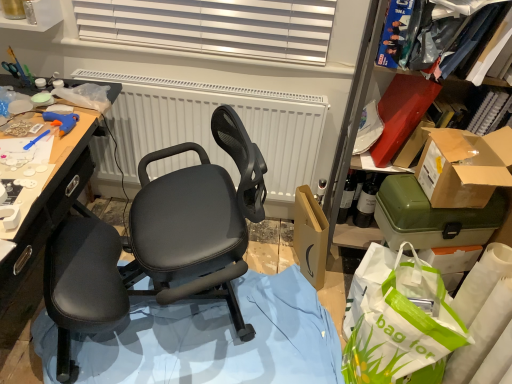
Locate an element on the screen. The image size is (512, 384). brown cardboard box at right, which appears as the first box when viewed from the top is located at coordinates point(460,170).

What do you see at coordinates (162, 240) in the screenshot? This screenshot has height=384, width=512. I see `matte black office chair at center` at bounding box center [162, 240].

Where is `white textured radiator at center`? white textured radiator at center is located at coordinates (210, 127).

Considering the positions of objects green plastic container at right, which ranks as the 2th box in top-to-bottom order, and matte black office chair at center in the image provided, who is more to the right, green plastic container at right, which ranks as the 2th box in top-to-bottom order, or matte black office chair at center?

green plastic container at right, which ranks as the 2th box in top-to-bottom order, is more to the right.

Which object is closer to the camera taking this photo, green plastic container at right, which ranks as the 2th box in top-to-bottom order, or matte black office chair at center?

matte black office chair at center is closer to the camera.

In the scene shown: Is green plastic container at right, which ranks as the 2th box in top-to-bottom order, with matte black office chair at center?

No.

From a real-world perspective, which object rests below the other?

matte black office chair at center.

Is matte black office chair at center further to the viewer compared to green plastic container at right, which ranks as the 2th box in top-to-bottom order?

No.

Starting from the matte black office chair at center, which box is the 1st one to the right? Please provide its 2D coordinates.

[(433, 217)]

Is matte black office chair at center positioned beyond the bounds of green plastic container at right, marked as the first box in a bottom-to-top arrangement?

That's correct, matte black office chair at center is outside of green plastic container at right, marked as the first box in a bottom-to-top arrangement.

Which of these two, matte black office chair at center or white textured radiator at center, is bigger?

With larger size is matte black office chair at center.

Locate an element on the screen. The width and height of the screenshot is (512, 384). radiator behind the matte black office chair at center is located at coordinates (210, 127).

Looking at this image, would you say matte black office chair at center is a long distance from white textured radiator at center?

They are positioned close to each other.

Looking at this image, from a real-world perspective, does brown cardboard box at right, which appears as the first box when viewed from the top, stand above matte black office chair at center?

Yes, from a real-world perspective, brown cardboard box at right, which appears as the first box when viewed from the top, is on top of matte black office chair at center.

What's the angular difference between brown cardboard box at right, which is the 2th box from bottom to top, and matte black office chair at center's facing directions?

brown cardboard box at right, which is the 2th box from bottom to top, and matte black office chair at center are facing 165 degrees away from each other.

This screenshot has height=384, width=512. Find the location of `box that is the 2nd one when counting upward from the matte black office chair at center (from the image's perspective)`. box that is the 2nd one when counting upward from the matte black office chair at center (from the image's perspective) is located at coordinates (460, 170).

Relative to matte black office chair at center, is brown cardboard box at right, which is the 2th box from bottom to top, in front or behind?

Visually, brown cardboard box at right, which is the 2th box from bottom to top, is located behind matte black office chair at center.

Can we say white textured radiator at center lies outside brown cardboard box at right, which is the 2th box from bottom to top?

Absolutely, white textured radiator at center is external to brown cardboard box at right, which is the 2th box from bottom to top.

Can you tell me how much white textured radiator at center and brown cardboard box at right, which is the 2th box from bottom to top, differ in facing direction?

171 degrees separate the facing orientations of white textured radiator at center and brown cardboard box at right, which is the 2th box from bottom to top.

In the image, is white textured radiator at center on the left side or the right side of brown cardboard box at right, which is the 2th box from bottom to top?

white textured radiator at center is positioned on brown cardboard box at right, which is the 2th box from bottom to top,'s left side.

Which object is further away from the camera, white textured radiator at center or brown cardboard box at right, which is the 2th box from bottom to top?

Positioned behind is white textured radiator at center.

Is brown cardboard box at right, which appears as the first box when viewed from the top, looking in the opposite direction of white textured radiator at center?

No, brown cardboard box at right, which appears as the first box when viewed from the top,'s orientation is not away from white textured radiator at center.

From the image's perspective, count 1st boxs downward from the white textured radiator at center and point to it. Please provide its 2D coordinates.

[(460, 170)]

How much distance is there between brown cardboard box at right, which is the 2th box from bottom to top, and white textured radiator at center?

brown cardboard box at right, which is the 2th box from bottom to top, is 29.25 inches away from white textured radiator at center.

Is green plastic container at right, marked as the first box in a bottom-to-top arrangement, far from brown cardboard box at right, which is the 2th box from bottom to top?

That's not correct — green plastic container at right, marked as the first box in a bottom-to-top arrangement, is a little close to brown cardboard box at right, which is the 2th box from bottom to top.

From a real-world perspective, is green plastic container at right, marked as the first box in a bottom-to-top arrangement, on top of brown cardboard box at right, which appears as the first box when viewed from the top?

No, from a real-world perspective, green plastic container at right, marked as the first box in a bottom-to-top arrangement, is not on top of brown cardboard box at right, which appears as the first box when viewed from the top.

Based on the photo, relative to brown cardboard box at right, which appears as the first box when viewed from the top, is green plastic container at right, which ranks as the 2th box in top-to-bottom order, in front or behind?

green plastic container at right, which ranks as the 2th box in top-to-bottom order, is positioned farther from the viewer than brown cardboard box at right, which appears as the first box when viewed from the top.

Looking at their sizes, would you say green plastic container at right, which ranks as the 2th box in top-to-bottom order, is wider or thinner than brown cardboard box at right, which is the 2th box from bottom to top?

Clearly, green plastic container at right, which ranks as the 2th box in top-to-bottom order, has more width compared to brown cardboard box at right, which is the 2th box from bottom to top.

This screenshot has height=384, width=512. What are the coordinates of `chair that is in front of the green plastic container at right, marked as the first box in a bottom-to-top arrangement` in the screenshot? It's located at [162, 240].

Locate an element on the screen. Image resolution: width=512 pixels, height=384 pixels. chair on the left of green plastic container at right, which ranks as the 2th box in top-to-bottom order is located at coordinates (162, 240).

When comparing their distances from white textured radiator at center, does brown cardboard box at right, which appears as the first box when viewed from the top, or green plastic container at right, marked as the first box in a bottom-to-top arrangement, seem closer?

The object closer to white textured radiator at center is green plastic container at right, marked as the first box in a bottom-to-top arrangement.

Looking at the image, which one is located further to matte black office chair at center, brown cardboard box at right, which is the 2th box from bottom to top, or white textured radiator at center?

The object further to matte black office chair at center is brown cardboard box at right, which is the 2th box from bottom to top.

Based on their spatial positions, is green plastic container at right, marked as the first box in a bottom-to-top arrangement, or matte black office chair at center further from white textured radiator at center?

green plastic container at right, marked as the first box in a bottom-to-top arrangement, lies further to white textured radiator at center than the other object.

When comparing their distances from white textured radiator at center, does green plastic container at right, which ranks as the 2th box in top-to-bottom order, or brown cardboard box at right, which appears as the first box when viewed from the top, seem further?

brown cardboard box at right, which appears as the first box when viewed from the top, lies further to white textured radiator at center than the other object.

Which object lies further to the anchor point green plastic container at right, marked as the first box in a bottom-to-top arrangement, brown cardboard box at right, which is the 2th box from bottom to top, or white textured radiator at center?

The object further to green plastic container at right, marked as the first box in a bottom-to-top arrangement, is white textured radiator at center.

Considering their positions, is matte black office chair at center positioned further to brown cardboard box at right, which appears as the first box when viewed from the top, than white textured radiator at center?

white textured radiator at center is further to brown cardboard box at right, which appears as the first box when viewed from the top.

Looking at the image, which one is located closer to matte black office chair at center, green plastic container at right, which ranks as the 2th box in top-to-bottom order, or brown cardboard box at right, which is the 2th box from bottom to top?

green plastic container at right, which ranks as the 2th box in top-to-bottom order, is positioned closer to the anchor matte black office chair at center.

Based on their spatial positions, is white textured radiator at center or green plastic container at right, marked as the first box in a bottom-to-top arrangement, further from matte black office chair at center?

green plastic container at right, marked as the first box in a bottom-to-top arrangement, lies further to matte black office chair at center than the other object.

Locate an element on the screen. The image size is (512, 384). box between white textured radiator at center and brown cardboard box at right, which appears as the first box when viewed from the top, from left to right is located at coordinates (433, 217).

Locate an element on the screen. The width and height of the screenshot is (512, 384). radiator between matte black office chair at center and brown cardboard box at right, which is the 2th box from bottom to top is located at coordinates (210, 127).

Find the location of a particular element. Image resolution: width=512 pixels, height=384 pixels. radiator between matte black office chair at center and green plastic container at right, marked as the first box in a bottom-to-top arrangement is located at coordinates (x=210, y=127).

Find the location of a particular element. Image resolution: width=512 pixels, height=384 pixels. box located between matte black office chair at center and brown cardboard box at right, which is the 2th box from bottom to top, in the left-right direction is located at coordinates (433, 217).